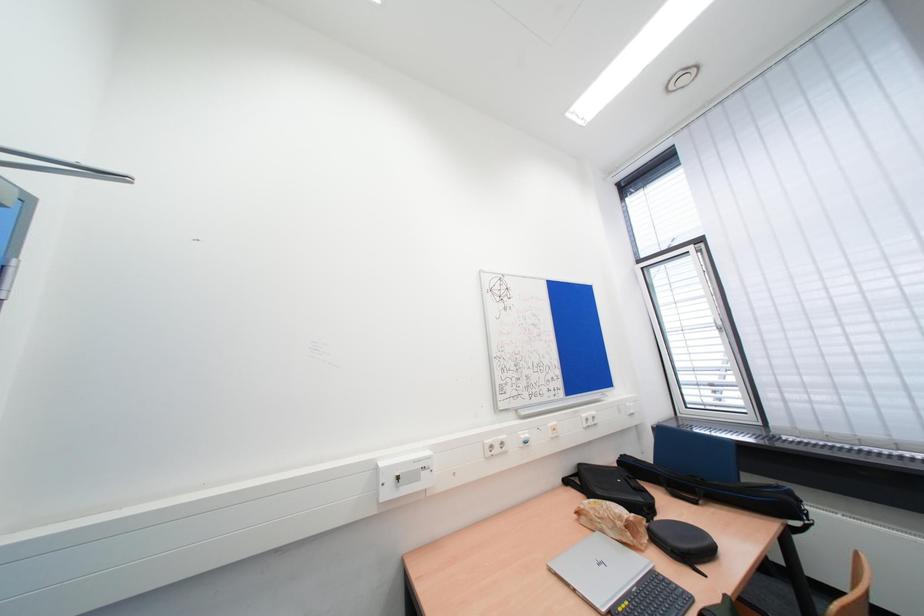
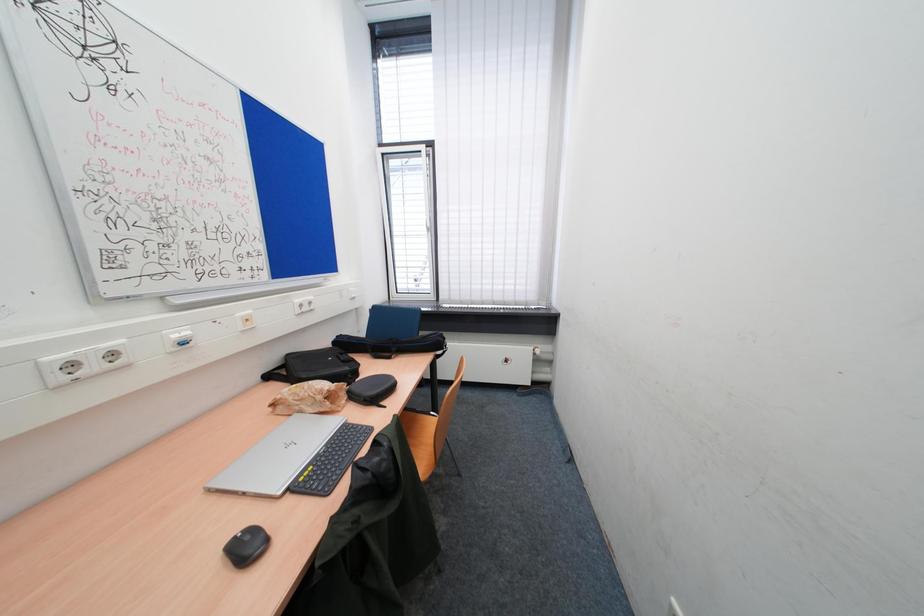
Consider the image. First-person continuous shooting, in which direction is the camera rotating?

The camera rotated toward right-down.